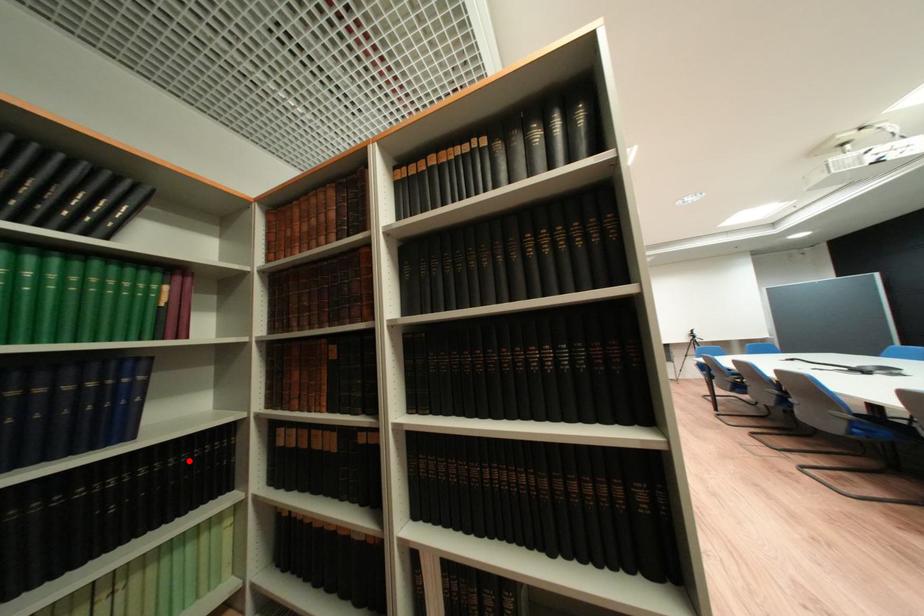
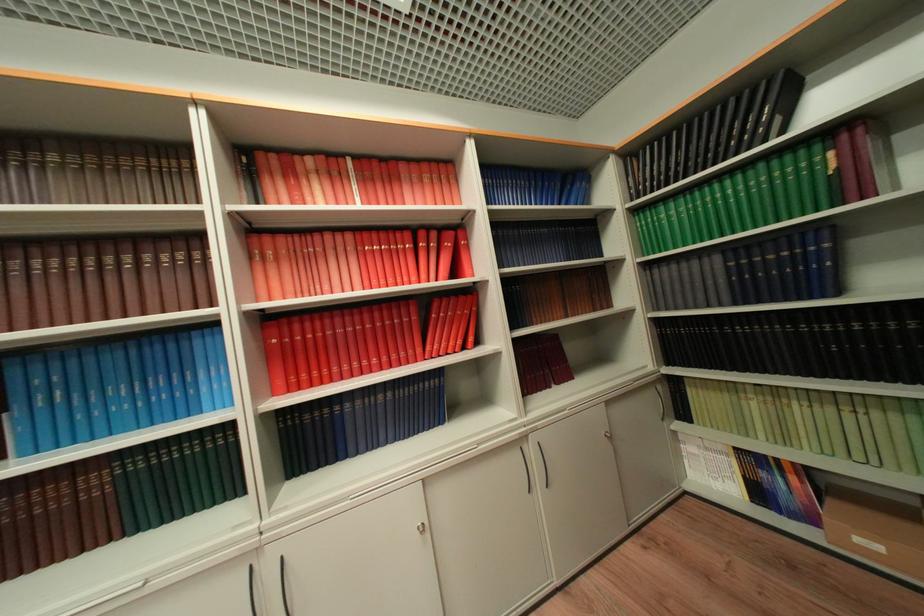
In the second image, find the point that corresponds to the highlighted location in the first image.

(914, 326)